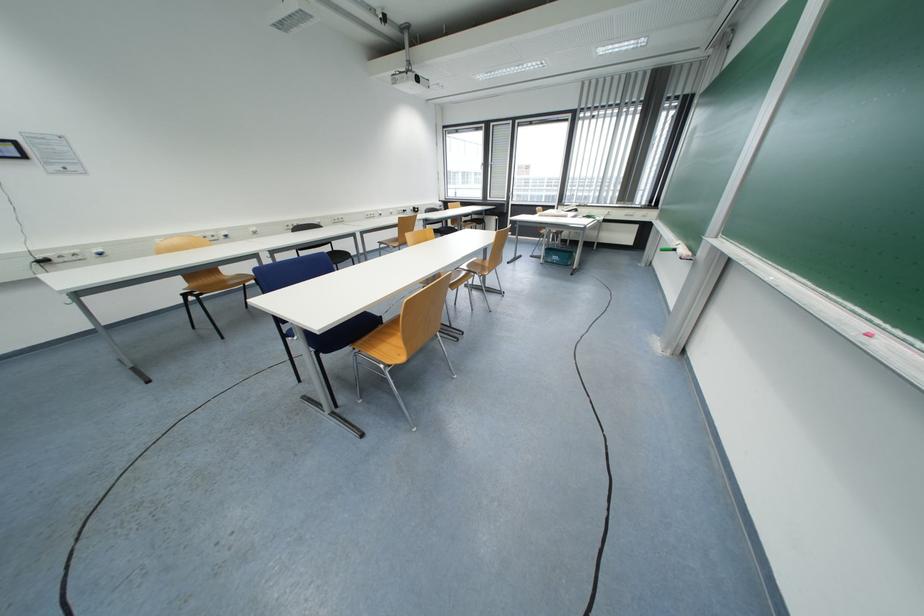
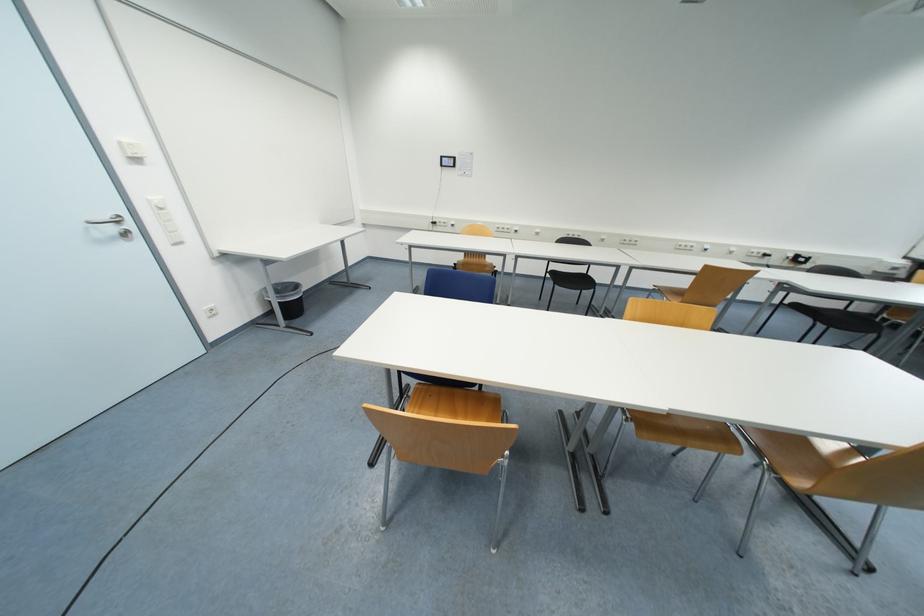
Find the pixel in the second image that matches point (260, 235) in the first image.

(541, 236)